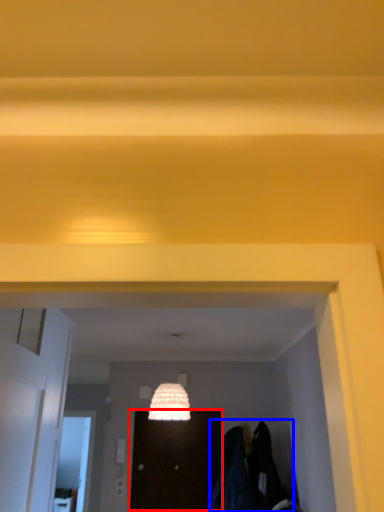
Question: Which point is closer to the camera, door (highlighted by a red box) or laundry (highlighted by a blue box)?

Choices:
 (A) door
 (B) laundry

Answer: (B)